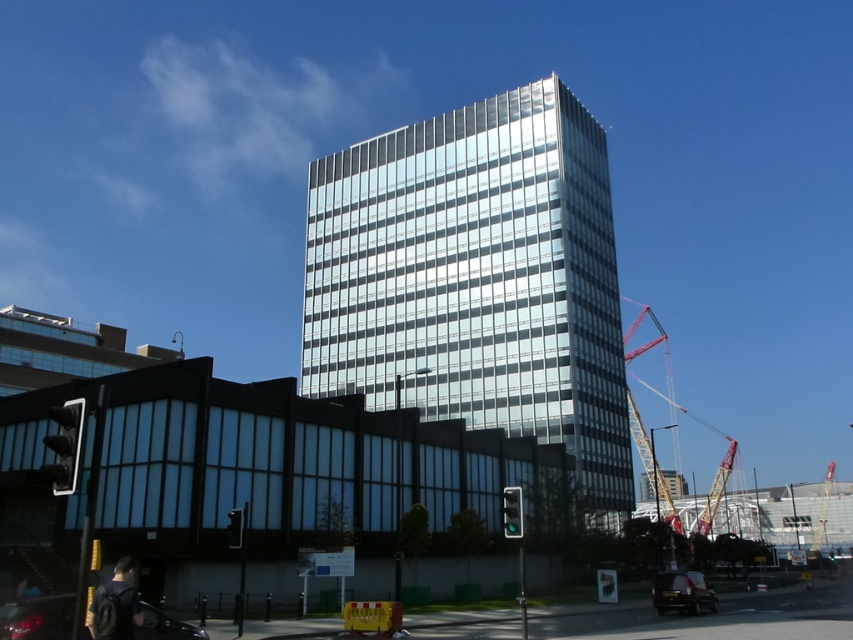
Who is taller, glassy reflective building at center or matte black car at lower left?

glassy reflective building at center

Between glassy reflective building at center and matte black car at lower left, which one is positioned lower?

matte black car at lower left is lower down.

Where is `glassy reflective building at center`? glassy reflective building at center is located at coordinates (477, 280).

This screenshot has width=853, height=640. I want to click on glassy reflective building at center, so click(x=477, y=280).

In the scene shown: Is matte black car at lower left positioned before yellow metallic crane at right?

Yes.

Is point (141, 602) positioned in front of point (639, 314)?

Yes, it is.

The width and height of the screenshot is (853, 640). Find the location of `matte black car at lower left`. matte black car at lower left is located at coordinates (38, 618).

Is point (20, 602) positioned behind point (705, 580)?

No, it is in front of (705, 580).

Which is below, matte black car at lower left or shiny black car at lower right?

Positioned lower is shiny black car at lower right.

Between point (1, 611) and point (691, 604), which one is positioned in front?

Point (1, 611)

Find the location of a particular element. matte black car at lower left is located at coordinates (38, 618).